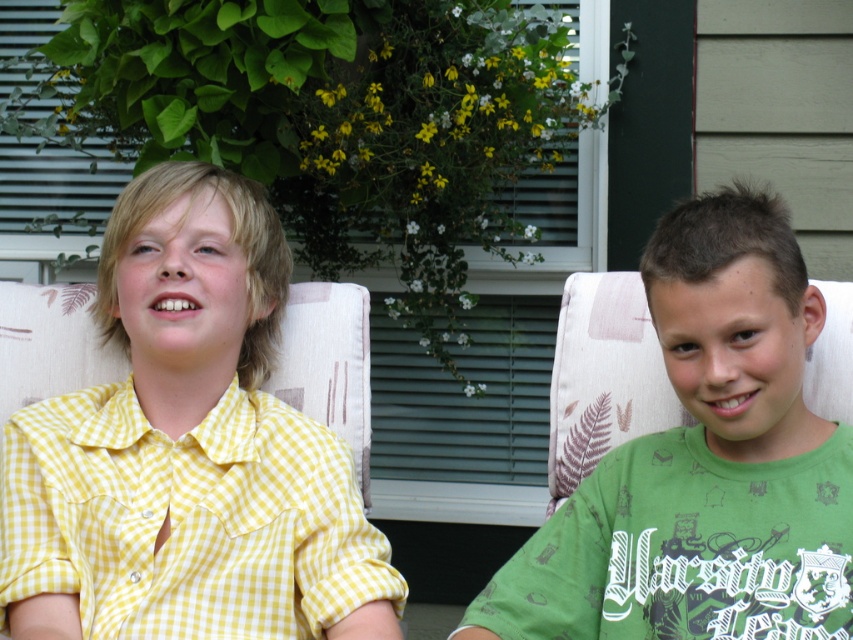
Question: Based on their relative distances, which object is nearer to the yellow checkered shirt at left?

Choices:
 (A) green matte shirt at right
 (B) green printed t-shirt at right

Answer: (B)

Question: Observing the image, what is the correct spatial positioning of green matte shirt at right in reference to green printed t-shirt at right?

Choices:
 (A) right
 (B) left

Answer: (A)

Question: Does green matte shirt at right appear under green printed t-shirt at right?

Choices:
 (A) no
 (B) yes

Answer: (A)

Question: Where is green matte shirt at right located in relation to yellow checkered shirt at left in the image?

Choices:
 (A) above
 (B) below

Answer: (A)

Question: Which point is farther to the camera?

Choices:
 (A) (711, 632)
 (B) (695, 204)

Answer: (B)

Question: Which point is farther to the camera?

Choices:
 (A) yellow checkered shirt at left
 (B) green matte shirt at right

Answer: (A)